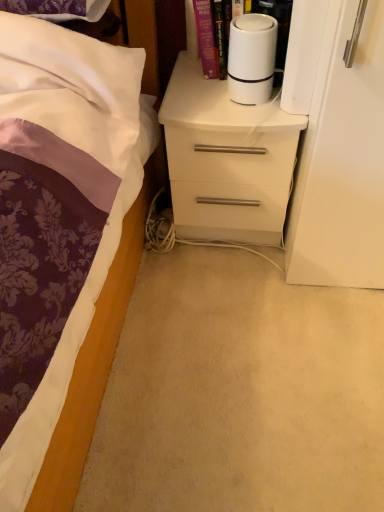
Question: Is white glossy chest of drawers at center oriented away from white matte cylindrical object at upper center?

Choices:
 (A) no
 (B) yes

Answer: (A)

Question: Does white glossy chest of drawers at center have a larger size compared to white matte cylindrical object at upper center?

Choices:
 (A) no
 (B) yes

Answer: (B)

Question: Considering the relative positions of white glossy chest of drawers at center and white matte cylindrical object at upper center in the image provided, is white glossy chest of drawers at center to the left of white matte cylindrical object at upper center from the viewer's perspective?

Choices:
 (A) yes
 (B) no

Answer: (A)

Question: From the image's perspective, is white glossy chest of drawers at center over white matte cylindrical object at upper center?

Choices:
 (A) yes
 (B) no

Answer: (B)

Question: Is white matte cylindrical object at upper center inside white glossy chest of drawers at center?

Choices:
 (A) yes
 (B) no

Answer: (B)

Question: From their relative heights in the image, would you say white matte cylindrical device at upper right is taller or shorter than white glossy chest of drawers at center?

Choices:
 (A) tall
 (B) short

Answer: (B)

Question: Is point (188, 12) positioned closer to the camera than point (246, 224)?

Choices:
 (A) farther
 (B) closer

Answer: (B)

Question: From the image's perspective, relative to white glossy chest of drawers at center, is white matte cylindrical device at upper right above or below?

Choices:
 (A) below
 (B) above

Answer: (B)

Question: In the image, is white matte cylindrical device at upper right on the left side or the right side of white glossy chest of drawers at center?

Choices:
 (A) right
 (B) left

Answer: (B)

Question: In terms of height, does white matte cylindrical object at upper center look taller or shorter compared to white matte cylindrical device at upper right?

Choices:
 (A) tall
 (B) short

Answer: (B)

Question: Relative to white matte cylindrical device at upper right, is white matte cylindrical object at upper center in front or behind?

Choices:
 (A) behind
 (B) front

Answer: (B)

Question: From a real-world perspective, is white matte cylindrical object at upper center physically located above or below white matte cylindrical device at upper right?

Choices:
 (A) below
 (B) above

Answer: (A)

Question: Do you think white matte cylindrical object at upper center is within white matte cylindrical device at upper right, or outside of it?

Choices:
 (A) outside
 (B) inside

Answer: (B)

Question: Would you say white matte cylindrical device at upper right is to the left or to the right of white matte cylindrical object at upper center in the picture?

Choices:
 (A) left
 (B) right

Answer: (A)

Question: Which is correct: white matte cylindrical device at upper right is inside white matte cylindrical object at upper center, or outside of it?

Choices:
 (A) inside
 (B) outside

Answer: (B)